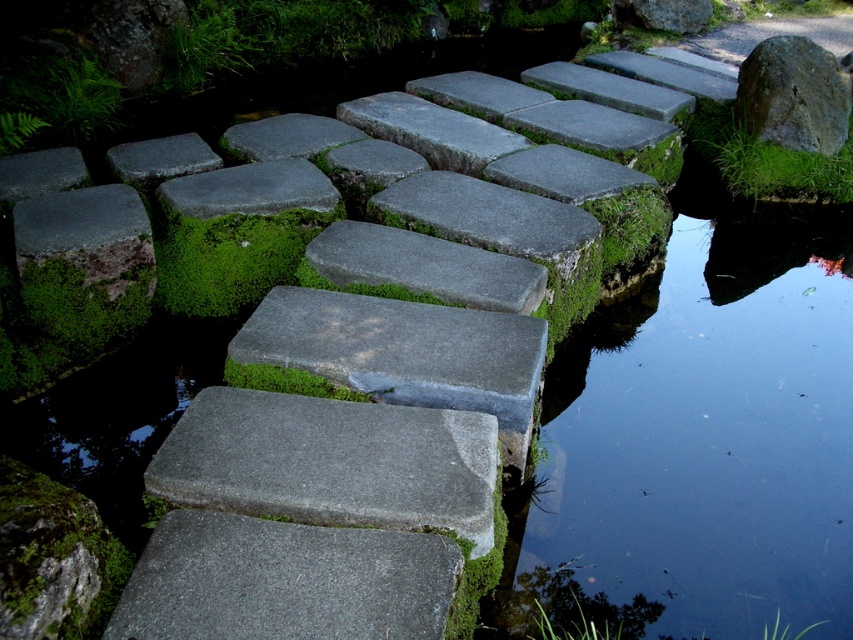
Which is behind, point (253, 224) or point (743, 92)?

The point (743, 92) is behind.

What do you see at coordinates (228, 257) in the screenshot? I see `green mossy stone at center` at bounding box center [228, 257].

What do you see at coordinates (228, 257) in the screenshot? The image size is (853, 640). I see `green mossy stone at center` at bounding box center [228, 257].

Where is `green mossy stone at center`? green mossy stone at center is located at coordinates (228, 257).